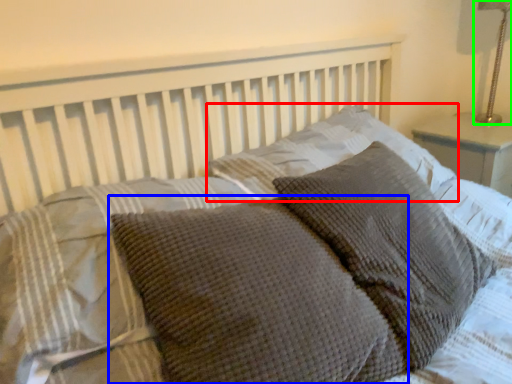
Question: Which object is positioned farthest from pillow (highlighted by a red box)? Select from pillow (highlighted by a blue box) and bedside lamp (highlighted by a green box).

Choices:
 (A) pillow
 (B) bedside lamp

Answer: (B)